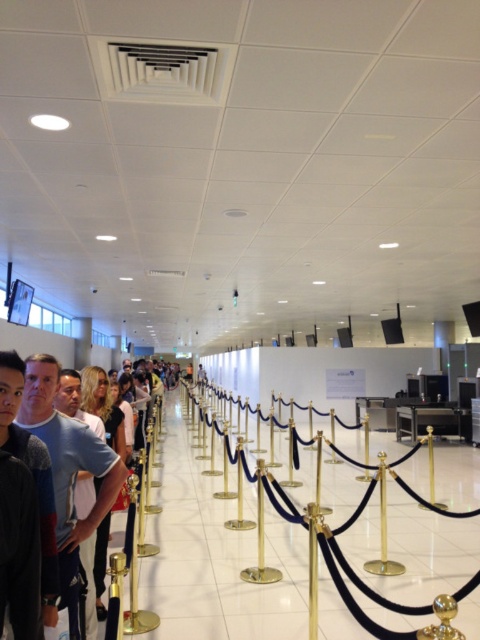
At what (x,y) coordinates should I click in order to perform the action: click on matte blue shirt at center. Please return your answer as a coordinate pair (x, y). Looking at the image, I should click on 68,468.

Does matte blue shirt at center appear over gold polished ball at center?

Indeed, matte blue shirt at center is positioned over gold polished ball at center.

In order to click on matte blue shirt at center in this screenshot , I will do `click(68, 468)`.

Is matte blue shirt at center to the left of dark gray sweater at center from the viewer's perspective?

No, matte blue shirt at center is not to the left of dark gray sweater at center.

Does matte blue shirt at center have a greater height compared to dark gray sweater at center?

Indeed, matte blue shirt at center has a greater height compared to dark gray sweater at center.

Describe the element at coordinates (68, 468) in the screenshot. I see `matte blue shirt at center` at that location.

The height and width of the screenshot is (640, 480). Identify the location of matte blue shirt at center. (68, 468).

Is dark gray sweater at center wider than gold polished ball at center?

Indeed, dark gray sweater at center has a greater width compared to gold polished ball at center.

Which is behind, point (45, 588) or point (444, 596)?

Positioned behind is point (45, 588).

Locate an element on the screen. dark gray sweater at center is located at coordinates (32, 476).